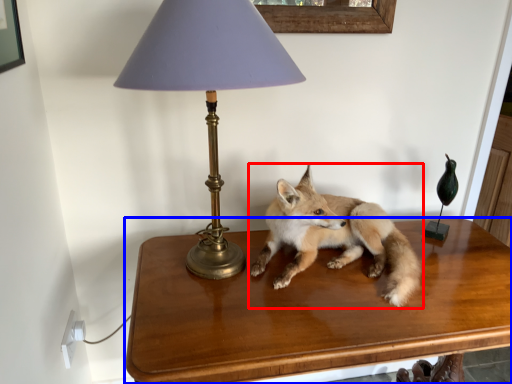
Question: Which object appears closest to the camera in this image, fox (highlighted by a red box) or table (highlighted by a blue box)?

Choices:
 (A) fox
 (B) table

Answer: (B)